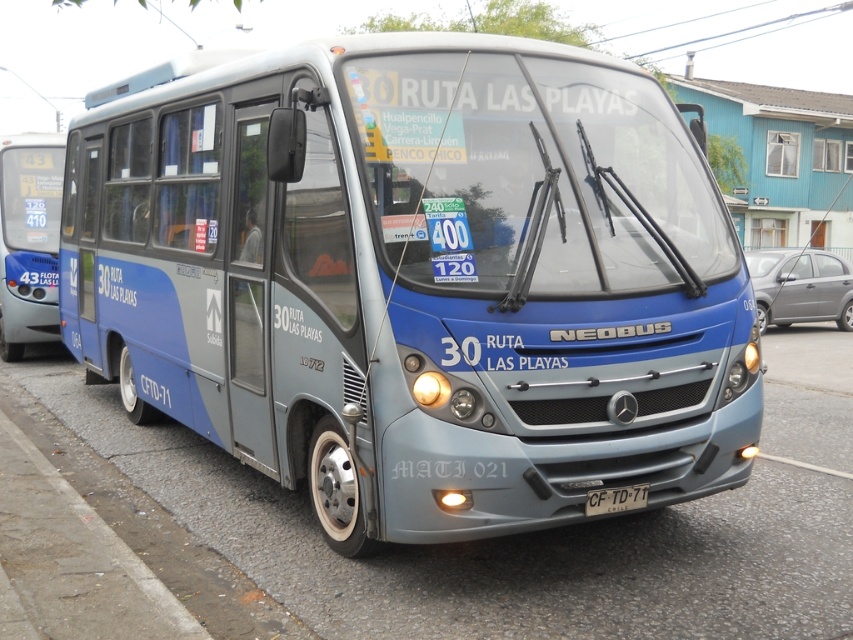
You are a passenger on the bus and want to take a photo of both the license plate and the destination sign. You notice two points marked on the windshield where you can lean your phone to stabilize the shot. The first point is at coordinate point (212, 189), and the second is at coordinate point (633, 484). Which point should you choose to ensure the license plate is in focus while capturing both points?

You should choose point (212, 189) because it is closer to the camera and will ensure the license plate is in focus while capturing both points.

You are a city planner analyzing the placement of public transport stops. Given the coordinates of the blue metallic bus at center as point (416, 278), what is the significance of this coordinate in relation to the bus?

The coordinate point (416, 278) represents the position of the blue metallic bus at center in the image, indicating its exact location for spatial analysis.